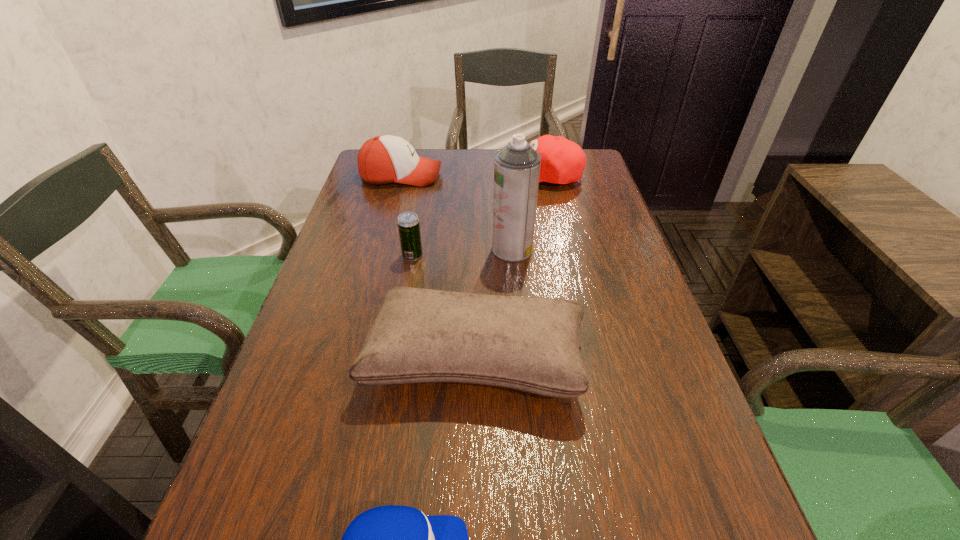
Find the location of a particular element. The height and width of the screenshot is (540, 960). baseball cap that is the second closest one to the shortest object is located at coordinates (384, 159).

You are a GUI agent. You are given a task and a screenshot of the screen. Output one action in this format:
    pyautogui.click(x=<x>, y=<y>)
    Task: Click on the baseball cap that is the second closest to the rightmost baseball cap
    The width and height of the screenshot is (960, 540).
    Given the screenshot: What is the action you would take?
    (x=391, y=539)